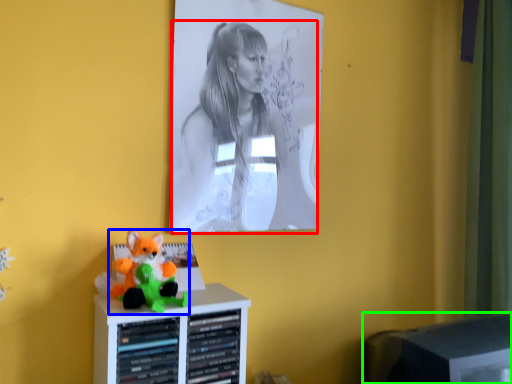
Question: Which is farther away from person (highlighted by a red box)? toy (highlighted by a blue box) or computer monitor (highlighted by a green box)?

Choices:
 (A) toy
 (B) computer monitor

Answer: (B)